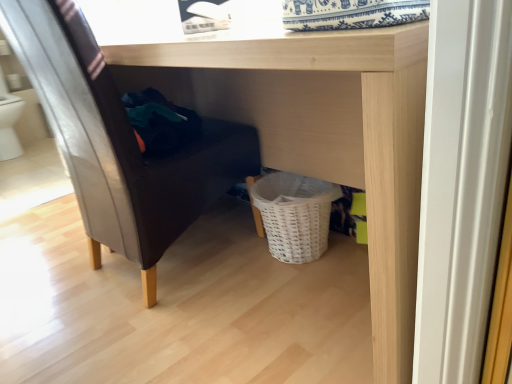
Question: Is wooden table at center not within matte black chair at left?

Choices:
 (A) no
 (B) yes

Answer: (B)

Question: From the image's perspective, is wooden table at center over matte black chair at left?

Choices:
 (A) yes
 (B) no

Answer: (B)

Question: Is wooden table at center oriented away from matte black chair at left?

Choices:
 (A) no
 (B) yes

Answer: (B)

Question: Can you confirm if wooden table at center is shorter than matte black chair at left?

Choices:
 (A) no
 (B) yes

Answer: (B)

Question: Considering the relative sizes of wooden table at center and matte black chair at left in the image provided, is wooden table at center bigger than matte black chair at left?

Choices:
 (A) yes
 (B) no

Answer: (A)

Question: Can you confirm if wooden table at center is positioned to the left of matte black chair at left?

Choices:
 (A) yes
 (B) no

Answer: (B)

Question: Can you confirm if matte black chair at left is positioned to the left of wooden table at center?

Choices:
 (A) no
 (B) yes

Answer: (B)

Question: From a real-world perspective, is matte black chair at left beneath wooden table at center?

Choices:
 (A) no
 (B) yes

Answer: (A)

Question: Considering the relative sizes of matte black chair at left and wooden table at center in the image provided, is matte black chair at left bigger than wooden table at center?

Choices:
 (A) no
 (B) yes

Answer: (A)

Question: Is matte black chair at left thinner than wooden table at center?

Choices:
 (A) yes
 (B) no

Answer: (A)

Question: From the image's perspective, would you say matte black chair at left is positioned over wooden table at center?

Choices:
 (A) yes
 (B) no

Answer: (A)

Question: From a real-world perspective, does matte black chair at left stand above wooden table at center?

Choices:
 (A) yes
 (B) no

Answer: (A)

Question: Considering the positions of wooden table at center and matte black chair at left in the image, is wooden table at center wider or thinner than matte black chair at left?

Choices:
 (A) wide
 (B) thin

Answer: (A)